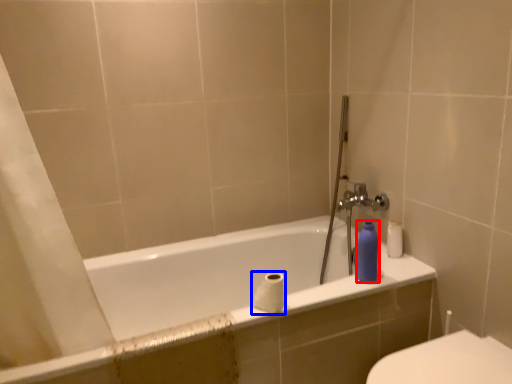
Question: Which object appears closest to the camera in this image, toiletry (highlighted by a red box) or toilet paper (highlighted by a blue box)?

Choices:
 (A) toiletry
 (B) toilet paper

Answer: (B)